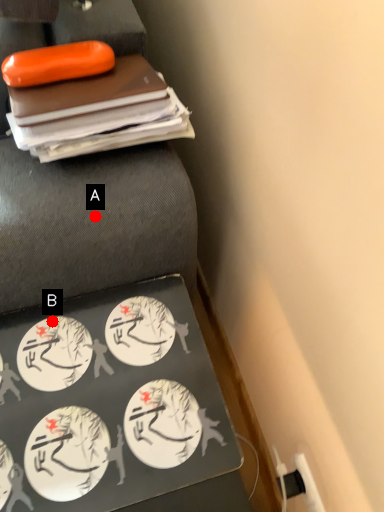
Question: Two points are circled on the image, labeled by A and B beside each circle. Which point is farther to the camera?

Choices:
 (A) A is further
 (B) B is further

Answer: (B)